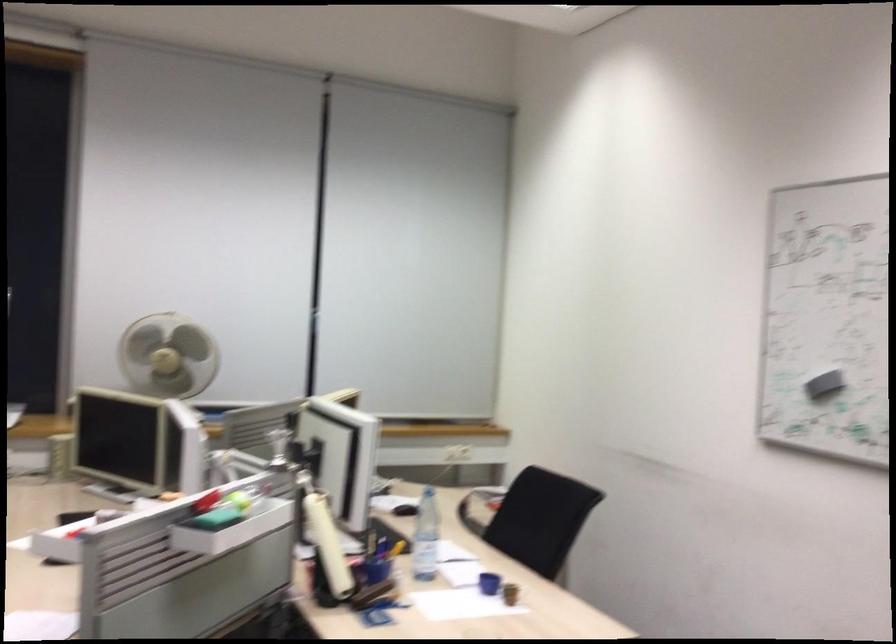
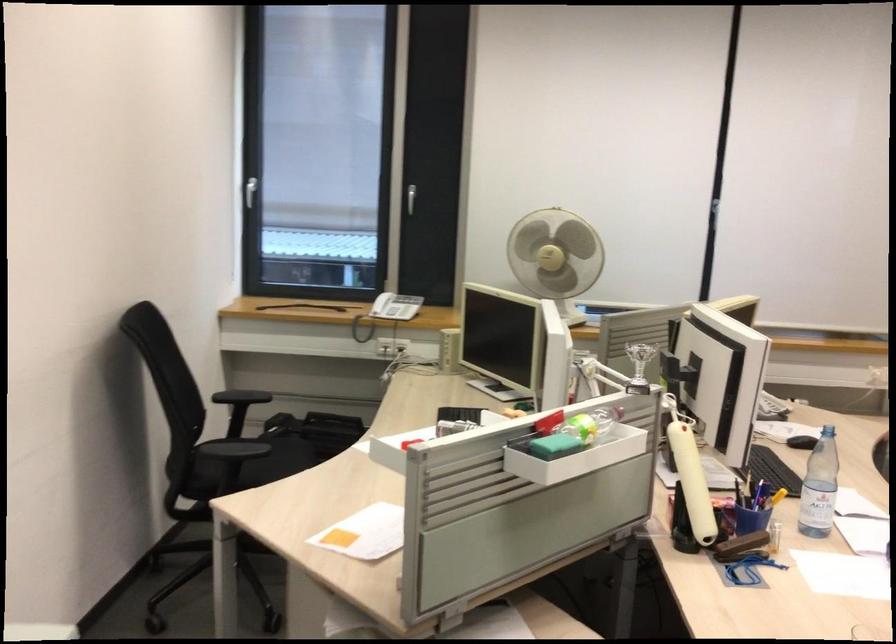
Find the pixel in the second image that matches (320,544) in the first image.

(690, 475)